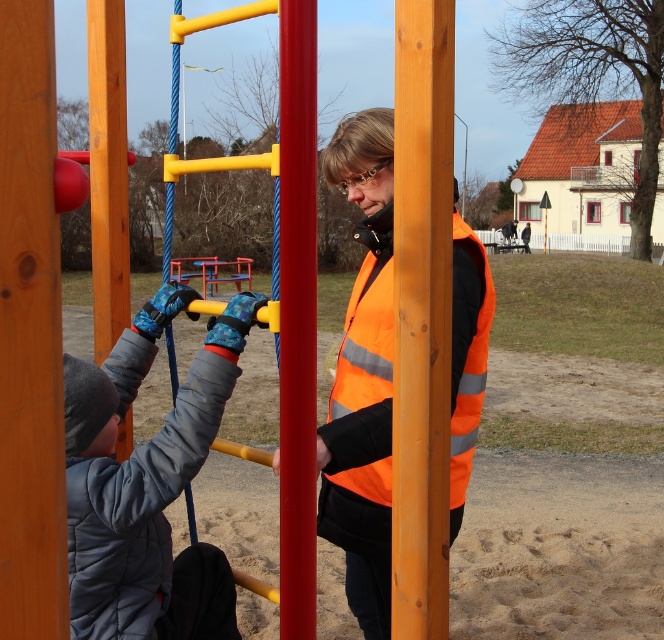
Can you confirm if gray fleece jacket at left is positioned below orange reflective safety vest at center?

Indeed, gray fleece jacket at left is positioned under orange reflective safety vest at center.

Can you confirm if gray fleece jacket at left is positioned to the left of orange reflective safety vest at center?

Yes, gray fleece jacket at left is to the left of orange reflective safety vest at center.

The height and width of the screenshot is (640, 664). I want to click on gray fleece jacket at left, so click(145, 483).

Is gray fleece jacket at left taller than wooden pole at center?

Incorrect, gray fleece jacket at left's height is not larger of wooden pole at center's.

Does gray fleece jacket at left come in front of wooden pole at center?

No, gray fleece jacket at left is behind wooden pole at center.

Who is more forward, (195, 572) or (406, 488)?

Positioned in front is point (406, 488).

The image size is (664, 640). I want to click on gray fleece jacket at left, so click(x=145, y=483).

Looking at this image, who is more forward, (293, 241) or (380, 381)?

Point (293, 241) is more forward.

Is red glossy pole at center below orange reflective safety vest at center?

Actually, red glossy pole at center is above orange reflective safety vest at center.

Is point (295, 214) behind point (461, 400)?

That is False.

Where is `red glossy pole at center`? red glossy pole at center is located at coordinates (297, 317).